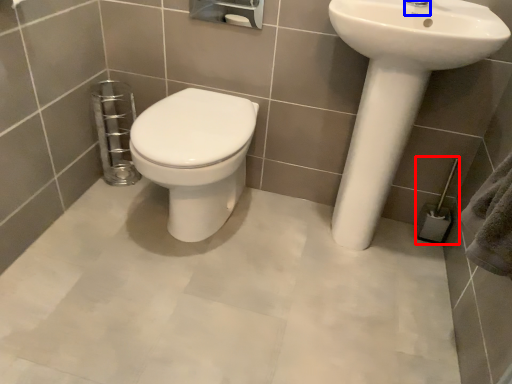
Question: Which of the following is the closest to the observer, towel bar (highlighted by a red box) or plumbing fixture (highlighted by a blue box)?

Choices:
 (A) towel bar
 (B) plumbing fixture

Answer: (B)